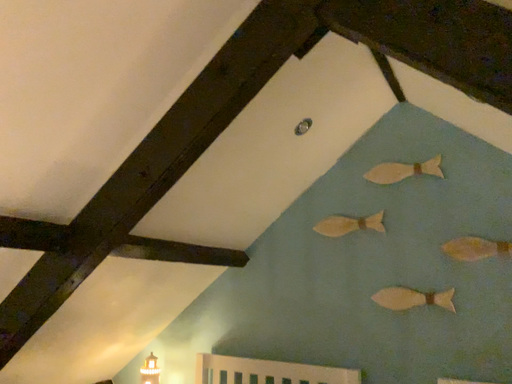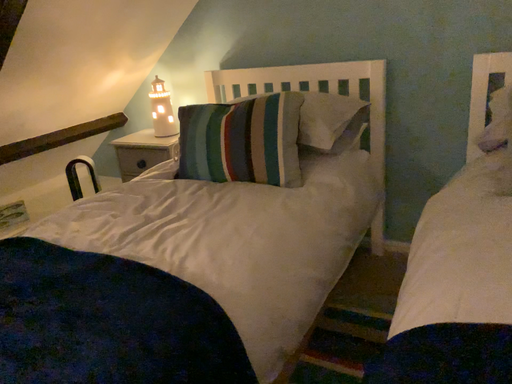
Question: How did the camera likely rotate when shooting the video?

Choices:
 (A) rotated upward
 (B) rotated downward

Answer: (B)